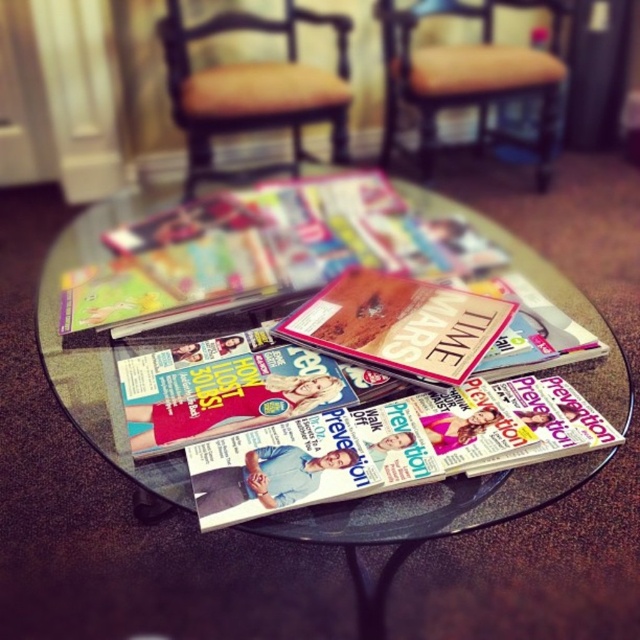
You are standing in the room and want to place a small vase on the clear glass table at center. The coordinates given are in normalized device coordinates. Is the point at coordinates point [99,349] on the clear glass table at center?

Yes, the point [99,349] marks the clear glass table at center, so placing the vase there would be appropriate.